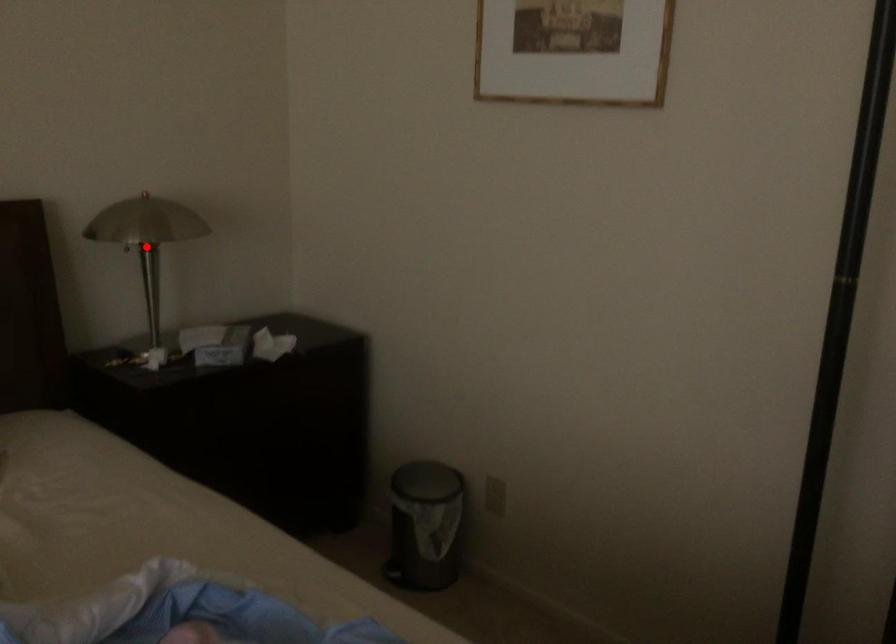
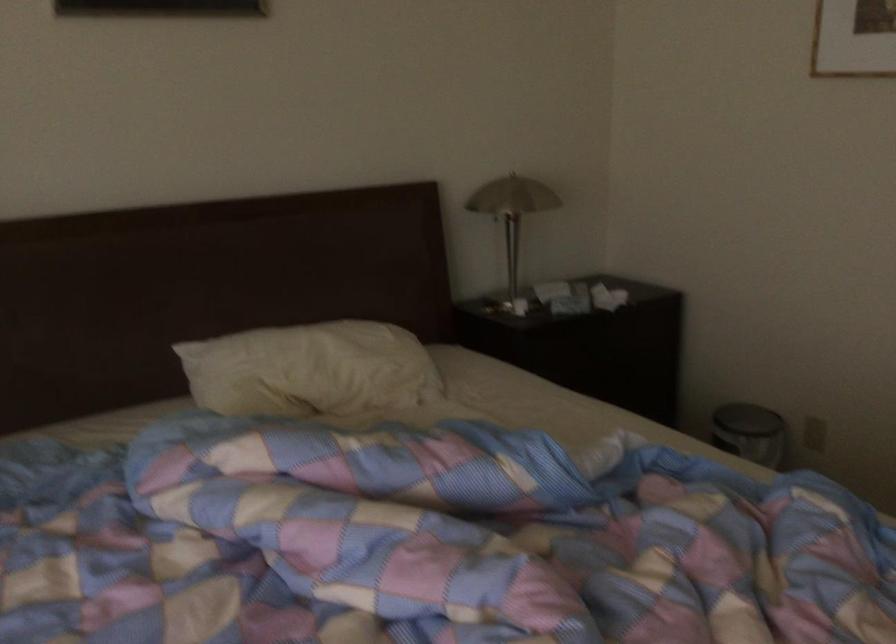
Question: I am providing you with two images of the same scene from different viewpoints. Image1 has a red point marked. In image2, the corresponding 3D location appears at what relative position? Reply with the corresponding letter.

Choices:
 (A) Closer
 (B) Farther

Answer: (B)